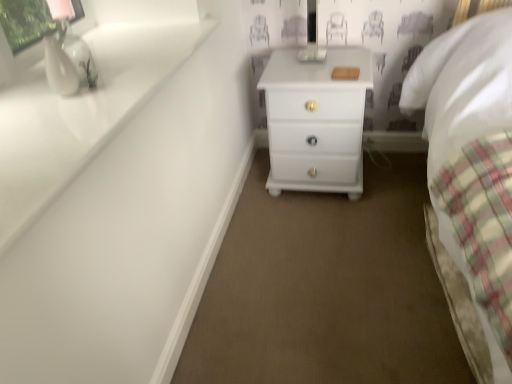
Image resolution: width=512 pixels, height=384 pixels. Identify the location of vacant area in front of white glossy vase at upper left. (63, 119).